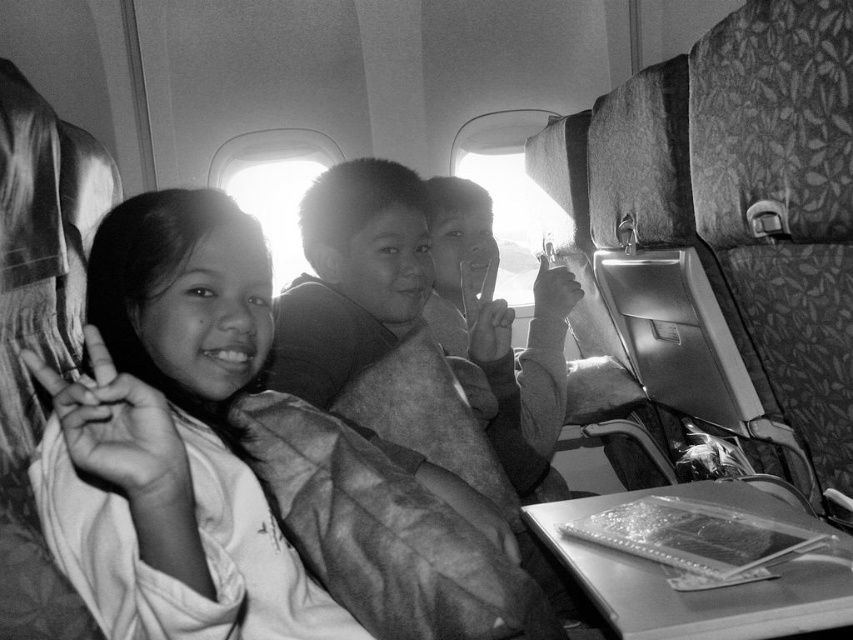
Does smooth fabric shirt at left have a lesser height compared to smooth skin child at center?

Yes, smooth fabric shirt at left is shorter than smooth skin child at center.

The image size is (853, 640). Find the location of `smooth fabric shirt at left`. smooth fabric shirt at left is located at coordinates (173, 436).